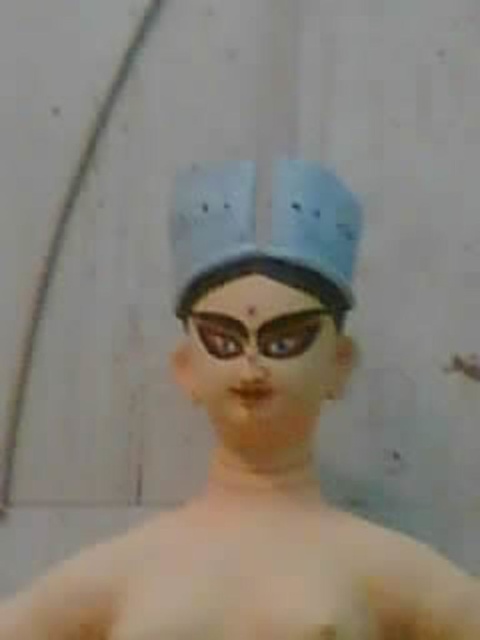
You are a fashion designer creating a new look for a runway show. You want to place the matte blue hat at center and the matte black goggles at center on a mannequin head. The mannequin head can only accommodate items within a 5 inch diameter. Can both items fit on the head without overlapping?

The matte blue hat at center and matte black goggles at center are 4.19 inches apart, so yes, both items can fit on the mannequin head without overlapping since the distance between them is within the 5 inch diameter limit.

You are standing in front of an art installation and see the matte blue hat at center. If you want to touch it, will you need to move closer than 1 meter?

The matte blue hat at center is 1.14 meters away from the viewer, so you need to move closer than 1 meter to reach it.

You are an artist trying to replicate the image. You have the matte blue hat at center and the matte black goggles at center. Which object should you place first to ensure proper layering?

You should place the matte black goggles at center first because the matte blue hat at center is positioned over it in the original image.